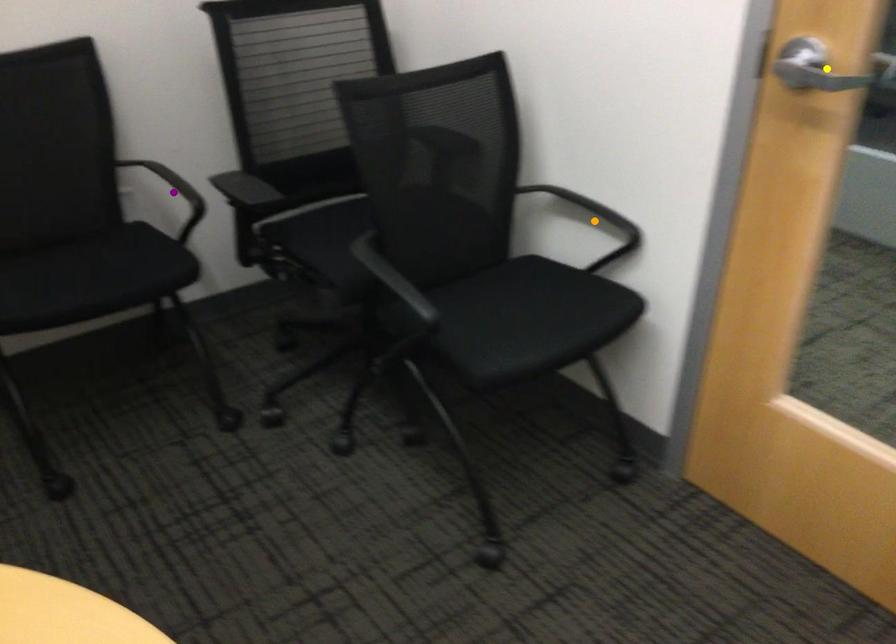
Order these from nearest to farthest:
purple point | orange point | yellow point

yellow point < orange point < purple point